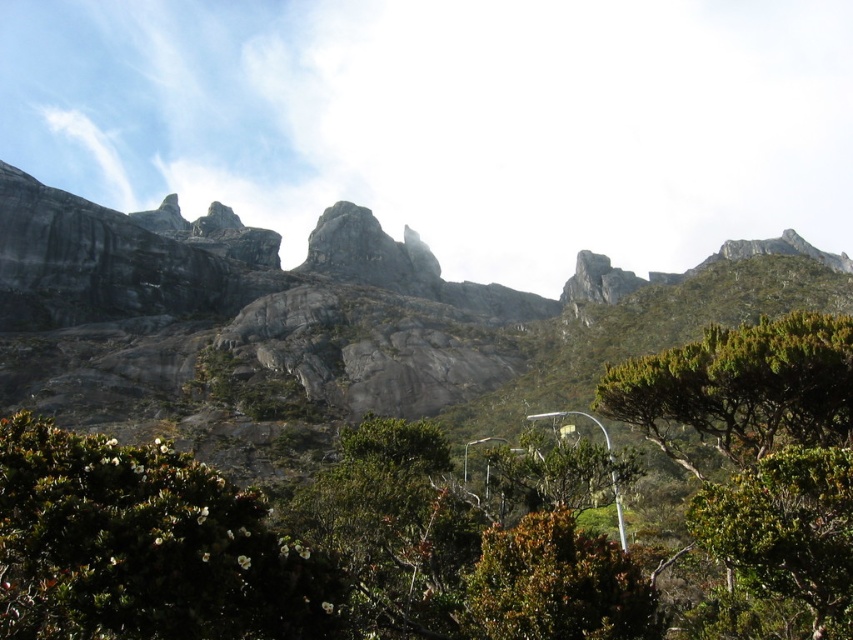
Is point (50, 257) less distant than point (619, 477)?

No.

Measure the distance between gray rock mountain at center and camera.

The distance of gray rock mountain at center from camera is 82.75 meters.

You are a GUI agent. You are given a task and a screenshot of the screen. Output one action in this format:
    pyautogui.click(x=<x>, y=<y>)
    Task: Click on the gray rock mountain at center
    The height and width of the screenshot is (640, 853).
    Given the screenshot: What is the action you would take?
    pyautogui.click(x=325, y=323)

Can you confirm if green leafy shrub at center is taller than gray rock mountain at center?

In fact, green leafy shrub at center may be shorter than gray rock mountain at center.

Between green leafy shrub at center and gray rock mountain at center, which one is positioned higher?

gray rock mountain at center is above.

Does point (235, 579) come in front of point (286, 291)?

Yes, point (235, 579) is in front of point (286, 291).

Identify the location of green leafy shrub at center. (456, 518).

The width and height of the screenshot is (853, 640). Describe the element at coordinates (325, 323) in the screenshot. I see `gray rock mountain at center` at that location.

Describe the element at coordinates (325, 323) in the screenshot. This screenshot has height=640, width=853. I see `gray rock mountain at center` at that location.

You are a GUI agent. You are given a task and a screenshot of the screen. Output one action in this format:
    pyautogui.click(x=<x>, y=<y>)
    Task: Click on the gray rock mountain at center
    Image resolution: width=853 pixels, height=640 pixels.
    Given the screenshot: What is the action you would take?
    pyautogui.click(x=325, y=323)